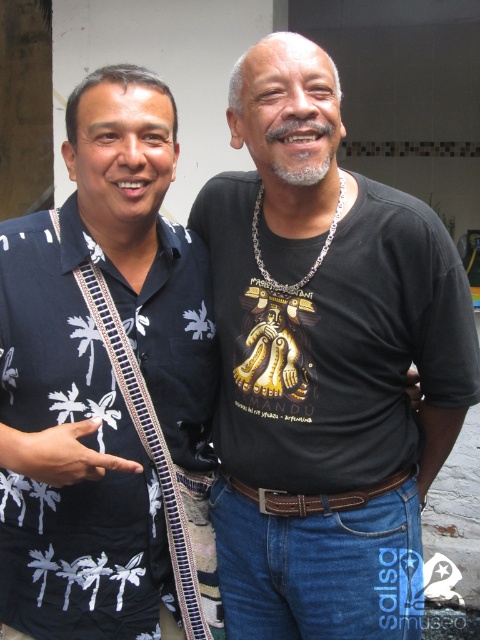
Based on the photo, you are trying to decide which item is taller between the white printed palm tree shirt at left and the brown leather belt at center. Based on the scene, which one is taller?

The white printed palm tree shirt at left is taller than the brown leather belt at center.